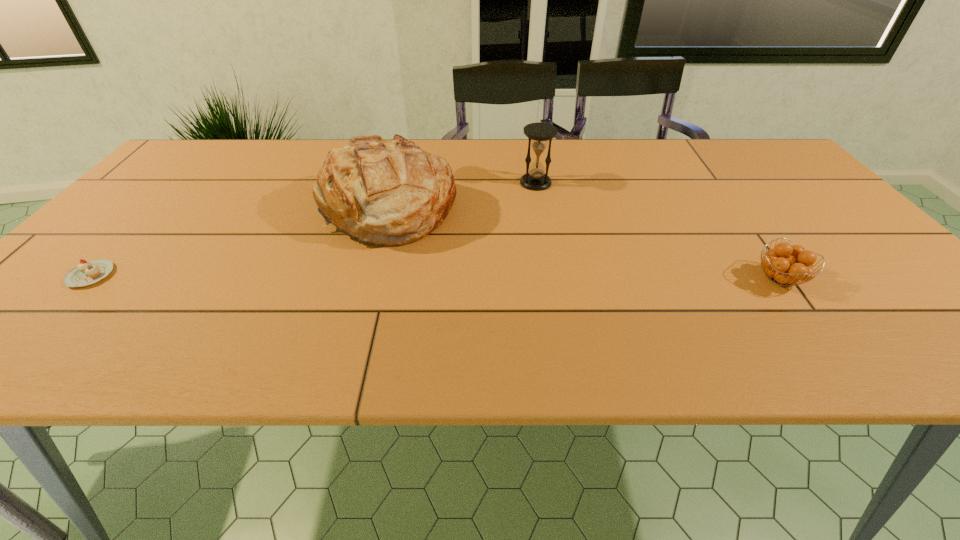
Locate an element on the screen. The height and width of the screenshot is (540, 960). the tallest object is located at coordinates (383, 192).

You are a GUI agent. You are given a task and a screenshot of the screen. Output one action in this format:
    pyautogui.click(x=<x>, y=<y>)
    Task: Click on the bread
    
    Given the screenshot: What is the action you would take?
    pyautogui.click(x=383, y=192)

At what (x,y) coordinates should I click in order to perform the action: click on the third object from left to right. Please return your answer as a coordinate pair (x, y). Looking at the image, I should click on (535, 179).

The height and width of the screenshot is (540, 960). Identify the location of hourglass. (535, 179).

At what (x,y) coordinates should I click in order to perform the action: click on the rightmost object. Please return your answer as a coordinate pair (x, y). Image resolution: width=960 pixels, height=540 pixels. Looking at the image, I should click on (785, 264).

Find the location of a particular element. The height and width of the screenshot is (540, 960). orange fruit is located at coordinates (785, 264).

Identify the location of the leftmost object. [x=86, y=273].

The width and height of the screenshot is (960, 540). What are the coordinates of `the shortest object` in the screenshot? It's located at (86, 273).

Find the location of a particular element. vacant point located 0.290m on the front of the bread is located at coordinates (351, 355).

Identify the location of vacant space situated on the left of the hourglass. (498, 183).